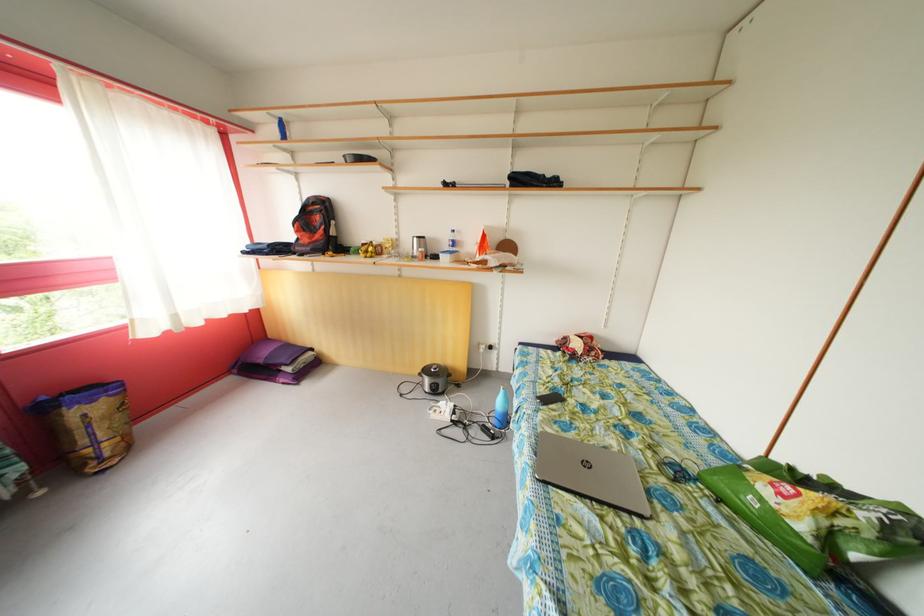
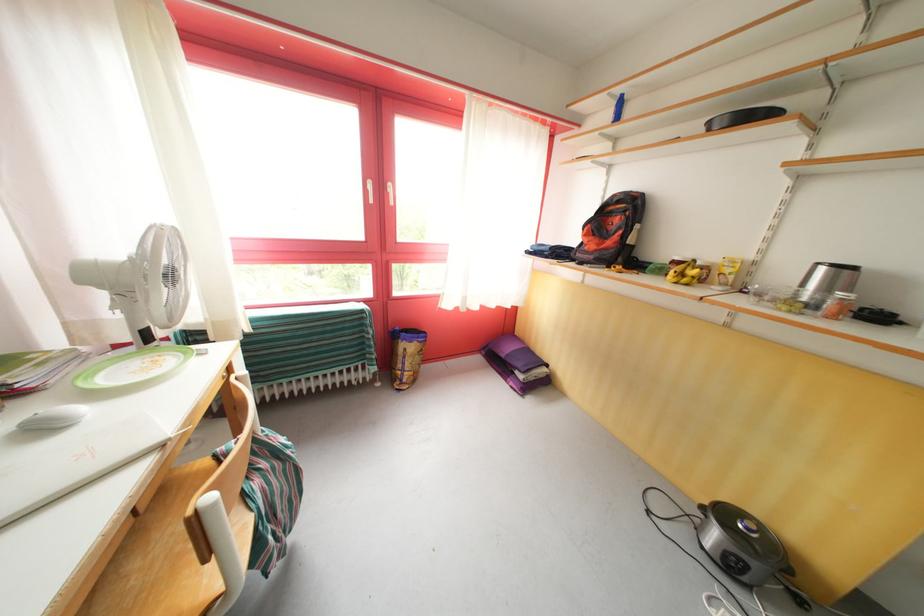
Locate, in the second image, the point that corresponds to pixel 296 241 in the first image.

(580, 245)